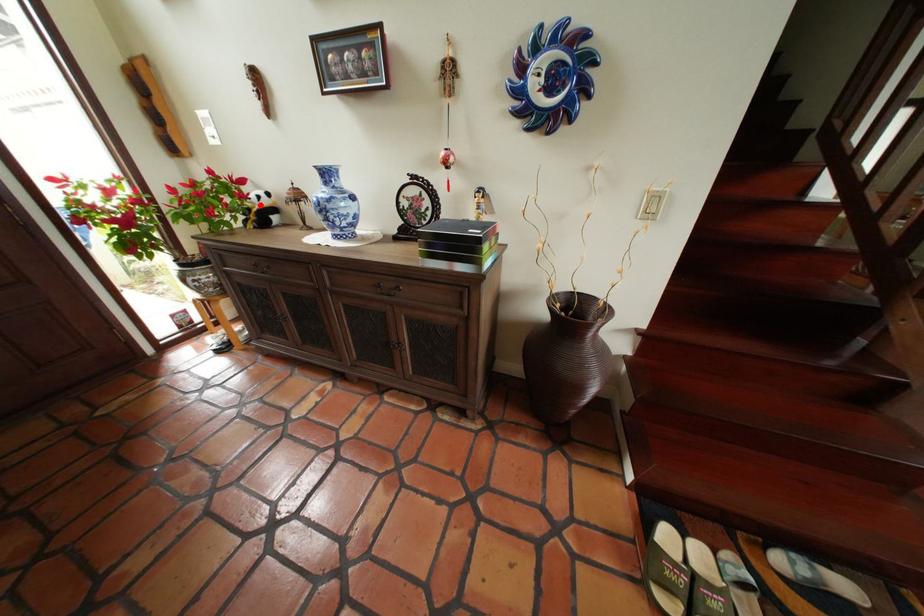
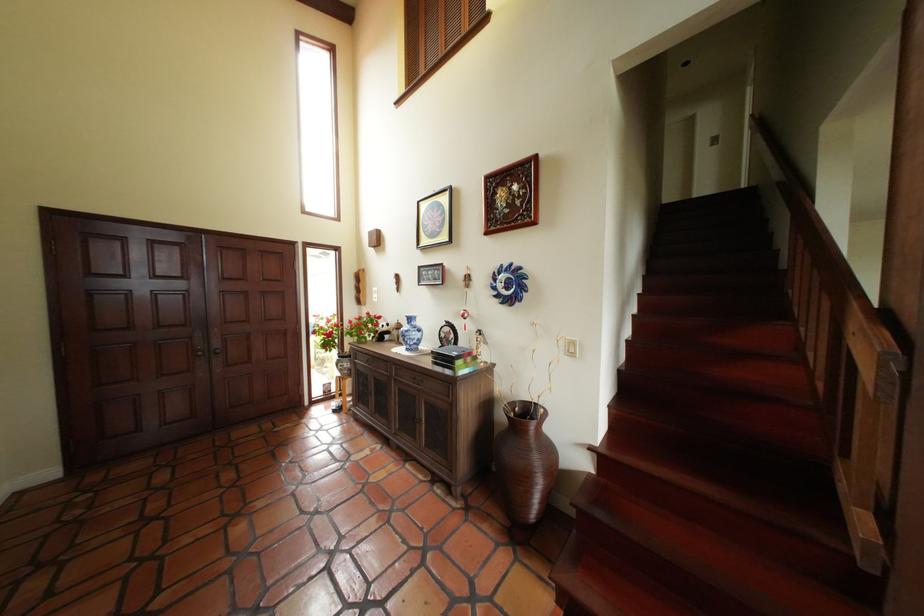
Locate, in the second image, the point that corresponds to the highlighted location in the first image.

(390, 330)